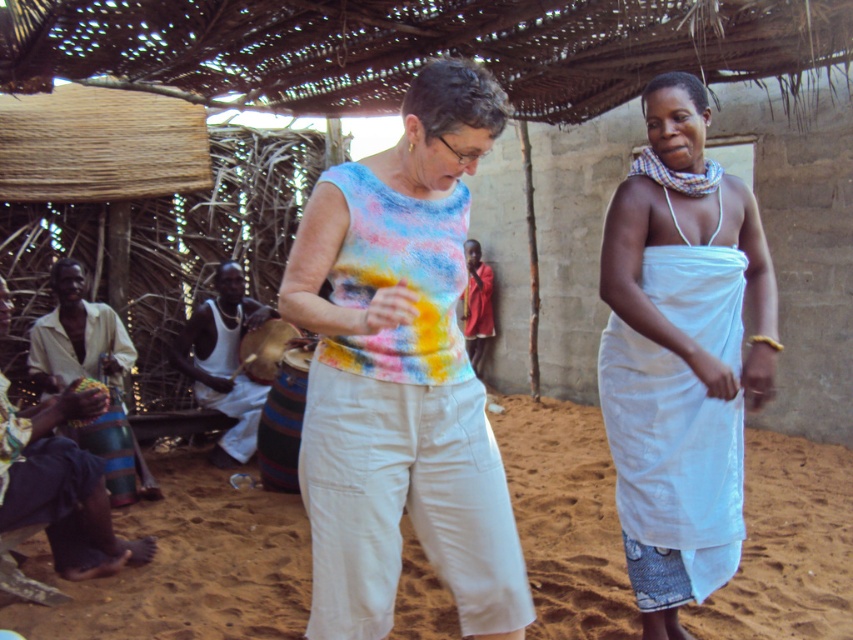
Question: Does multicolored tie-dye tank top at center have a larger size compared to white cloth drum at lower left?

Choices:
 (A) yes
 (B) no

Answer: (B)

Question: Which object appears farthest from the camera in this image?

Choices:
 (A) blue fabric drum at lower left
 (B) white cloth at center
 (C) multicolored tie-dye tank top at center

Answer: (A)

Question: Which of the following is the farthest from the observer?

Choices:
 (A) white cloth drum at lower left
 (B) multicolored tie-dye tank top at center
 (C) red fabric shirt at center

Answer: (C)

Question: Which point is farther from the camera taking this photo?

Choices:
 (A) (235, 362)
 (B) (488, 332)
 (C) (38, 429)

Answer: (B)

Question: Is beige sand at lower center to the left of blue fabric drum at lower left from the viewer's perspective?

Choices:
 (A) no
 (B) yes

Answer: (A)

Question: Is white cloth at center smaller than red fabric shirt at center?

Choices:
 (A) no
 (B) yes

Answer: (A)